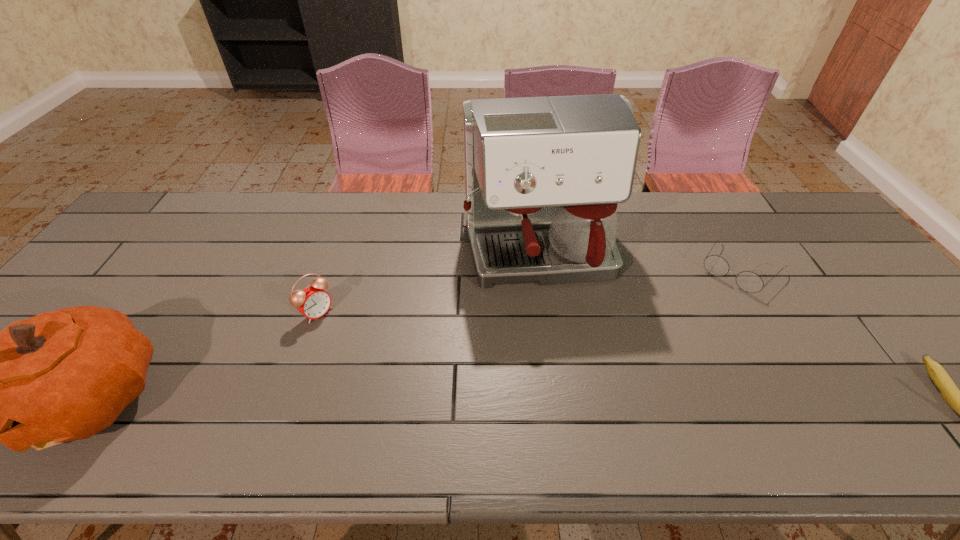
This screenshot has height=540, width=960. What are the coordinates of `unoccupied area between the spectacles and the fourth object from right to left` in the screenshot? It's located at (529, 290).

I want to click on free space that is in between the shortest object and the third object from left to right, so click(x=639, y=262).

Identify the location of vacant space that's between the tallest object and the spectacles. The width and height of the screenshot is (960, 540). (639, 262).

I want to click on the closest object to the coffee maker, so click(748, 281).

Select which object appears as the third closest to the fourth shortest object. Please provide its 2D coordinates. Your answer should be formatted as a tuple, i.e. [(x, y)], where the tuple contains the x and y coordinates of a point satisfying the conditions above.

[(748, 281)]

Find the location of `free location that satisfies the following two spatial constraints: 1. on the back side of the second object from left to right; 2. on the left side of the shortest object`. free location that satisfies the following two spatial constraints: 1. on the back side of the second object from left to right; 2. on the left side of the shortest object is located at coordinates (332, 268).